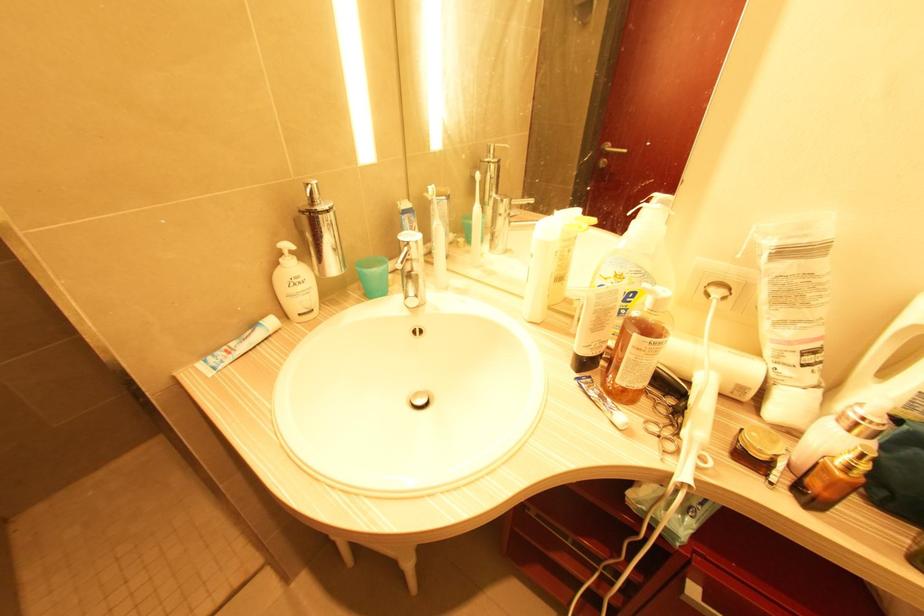
The height and width of the screenshot is (616, 924). I want to click on faucet handle, so click(410, 268).